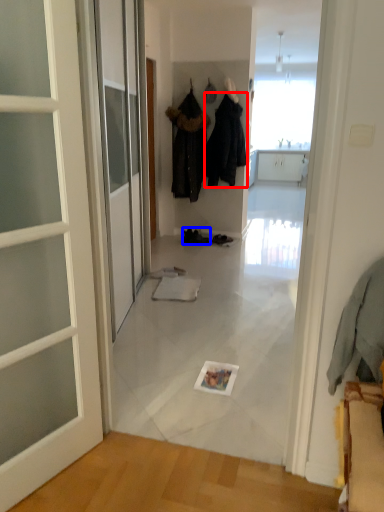
Question: Which object is further to the camera taking this photo, clothing (highlighted by a red box) or footwear (highlighted by a blue box)?

Choices:
 (A) clothing
 (B) footwear

Answer: (B)